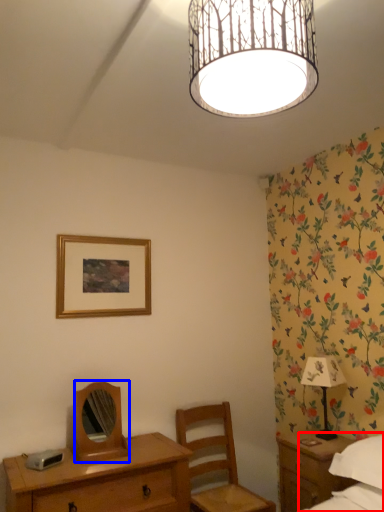
Question: Which point is further to the camera, bed (highlighted by a red box) or mirror (highlighted by a blue box)?

Choices:
 (A) bed
 (B) mirror

Answer: (B)